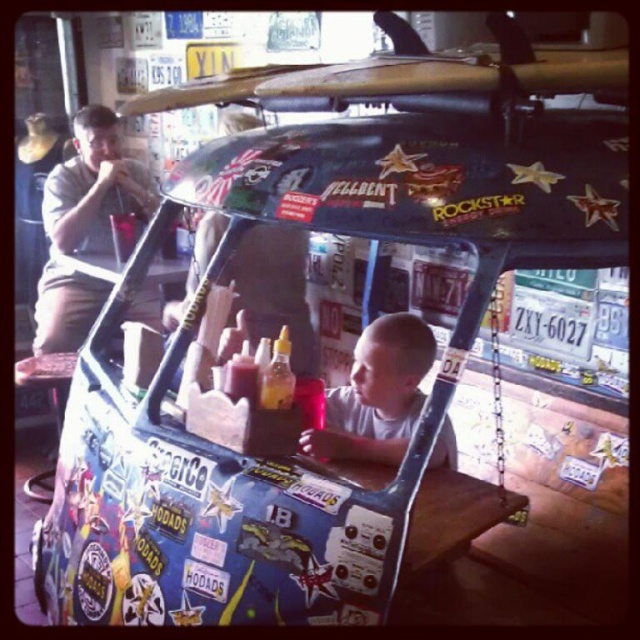
Question: Which point is closer to the camera?

Choices:
 (A) (577, 64)
 (B) (54, 307)

Answer: (A)

Question: Can you confirm if stickered plastic surfboard at center is positioned to the right of matte khaki shorts at left?

Choices:
 (A) yes
 (B) no

Answer: (A)

Question: Which object is farther from the camera taking this photo?

Choices:
 (A) wooden surfboard at upper center
 (B) matte khaki shorts at left
 (C) stickered plastic surfboard at center

Answer: (B)

Question: Can you confirm if wooden surfboard at upper center is positioned to the left of smooth skin child at center?

Choices:
 (A) no
 (B) yes

Answer: (B)

Question: Is wooden surfboard at upper center wider than smooth skin child at center?

Choices:
 (A) no
 (B) yes

Answer: (B)

Question: Which point is farther from the camera taking this photo?

Choices:
 (A) (99, 154)
 (B) (413, 358)
 (C) (481, 118)

Answer: (A)